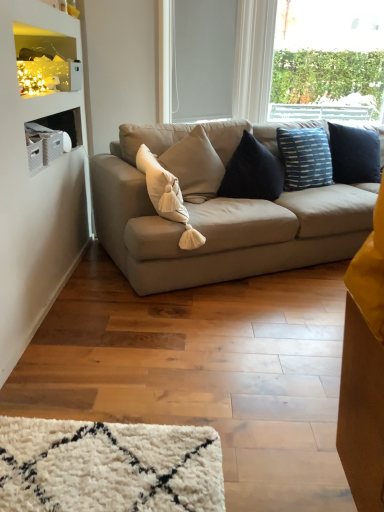
Question: Is the position of matte white shelf at upper left less distant than that of beige fabric pillow at center?

Choices:
 (A) no
 (B) yes

Answer: (A)

Question: Can we say matte white shelf at upper left lies outside beige fabric pillow at center?

Choices:
 (A) no
 (B) yes

Answer: (B)

Question: Does matte white shelf at upper left contain beige fabric pillow at center?

Choices:
 (A) no
 (B) yes

Answer: (A)

Question: Is matte white shelf at upper left next to beige fabric pillow at center and touching it?

Choices:
 (A) no
 (B) yes

Answer: (A)

Question: Does matte white shelf at upper left have a smaller size compared to beige fabric pillow at center?

Choices:
 (A) no
 (B) yes

Answer: (B)

Question: Does point (165, 199) appear closer or farther from the camera than point (33, 33)?

Choices:
 (A) farther
 (B) closer

Answer: (A)

Question: From the image's perspective, is beige fabric pillow at center located above or below matte white shelf at upper left?

Choices:
 (A) below
 (B) above

Answer: (A)

Question: In terms of size, does beige fabric pillow at center appear bigger or smaller than matte white shelf at upper left?

Choices:
 (A) small
 (B) big

Answer: (B)

Question: From a real-world perspective, is beige fabric pillow at center physically located above or below matte white shelf at upper left?

Choices:
 (A) below
 (B) above

Answer: (A)

Question: Considering their positions, is matte white shelf at upper left located in front of or behind beige fabric pillow at center?

Choices:
 (A) front
 (B) behind

Answer: (B)

Question: Considering the positions of matte white shelf at upper left and beige fabric pillow at center in the image, is matte white shelf at upper left wider or thinner than beige fabric pillow at center?

Choices:
 (A) thin
 (B) wide

Answer: (A)

Question: In terms of height, does matte white shelf at upper left look taller or shorter compared to beige fabric pillow at center?

Choices:
 (A) tall
 (B) short

Answer: (B)

Question: From the image's perspective, relative to beige fabric pillow at center, is matte white shelf at upper left above or below?

Choices:
 (A) above
 (B) below

Answer: (A)

Question: Which is correct: white matte window screen at upper center is inside beige fabric pillow at center, or outside of it?

Choices:
 (A) inside
 (B) outside

Answer: (B)

Question: Looking at the image, does white matte window screen at upper center seem bigger or smaller compared to beige fabric pillow at center?

Choices:
 (A) small
 (B) big

Answer: (A)